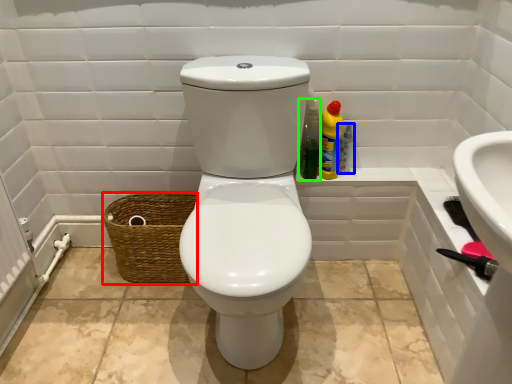
Question: Which object is positioned farthest from basket (highlighted by a red box)? Select from bottle (highlighted by a blue box) and cleaning product (highlighted by a green box).

Choices:
 (A) bottle
 (B) cleaning product

Answer: (A)